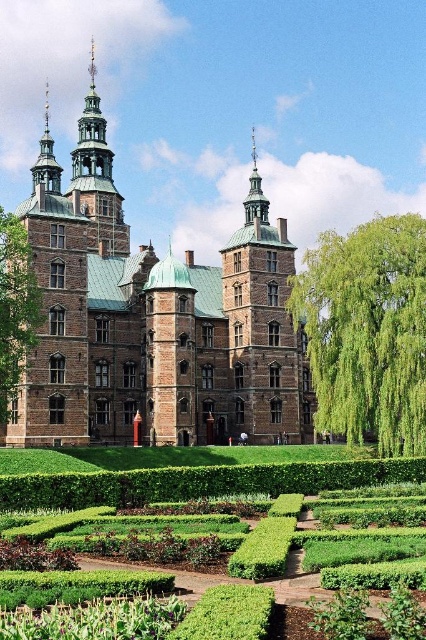
Question: Is green hedge at lower center positioned before green copper tower at upper center?

Choices:
 (A) yes
 (B) no

Answer: (A)

Question: Which is nearer to the green hedge at lower center?

Choices:
 (A) brown brick palace at center
 (B) green leafy hedge at right
 (C) green leafy hedge at lower center

Answer: (C)

Question: Which is farther from the green copper tower at upper center?

Choices:
 (A) green hedge at lower center
 (B) brown brick palace at center

Answer: (A)

Question: Considering the relative positions of brown brick palace at center and green copper tower at upper center in the image provided, where is brown brick palace at center located with respect to green copper tower at upper center?

Choices:
 (A) above
 (B) below

Answer: (B)

Question: Does brown brick palace at center have a greater width compared to green leafy hedge at lower center?

Choices:
 (A) yes
 (B) no

Answer: (A)

Question: Estimate the real-world distances between objects in this image. Which object is closer to the green leafy hedge at lower center?

Choices:
 (A) brown brick palace at center
 (B) green copper tower at upper center

Answer: (A)